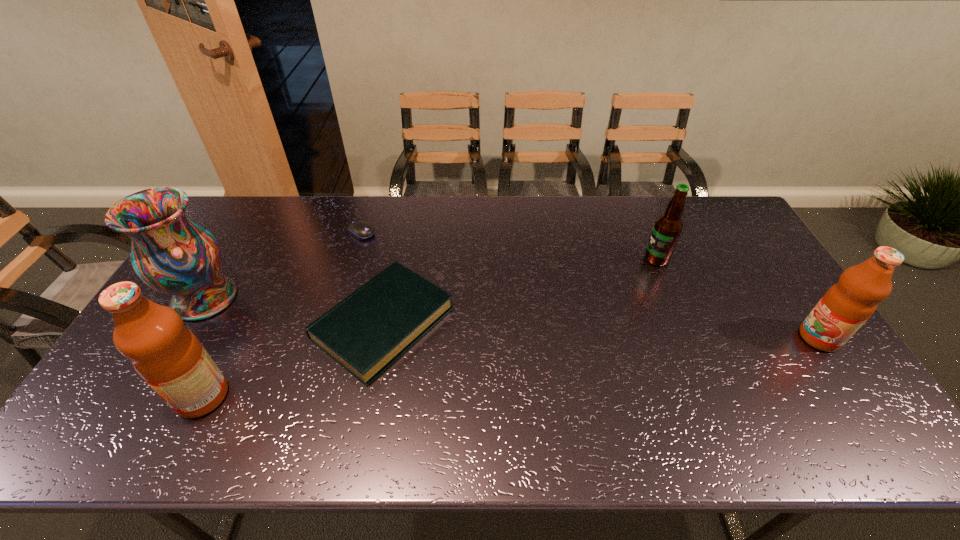
Where is `free space located 0.150m on the front label of the left fruit juice`? free space located 0.150m on the front label of the left fruit juice is located at coordinates (116, 396).

Identify the location of vacant space located on the front label of the left fruit juice. [x=120, y=396].

You are a GUI agent. You are given a task and a screenshot of the screen. Output one action in this format:
    pyautogui.click(x=<x>, y=<y>)
    Task: Click on the vacant space located 0.070m on the front label of the left fruit juice
    This screenshot has width=960, height=540.
    Given the screenshot: What is the action you would take?
    pyautogui.click(x=149, y=396)

Image resolution: width=960 pixels, height=540 pixels. Find the location of `vacant region located on the front label of the shorter fruit juice`. vacant region located on the front label of the shorter fruit juice is located at coordinates (691, 338).

This screenshot has width=960, height=540. I want to click on blank area located on the front label of the shorter fruit juice, so click(684, 338).

What are the coordinates of `blank space located on the front label of the shorter fruit juice` in the screenshot? It's located at (750, 338).

This screenshot has height=540, width=960. Find the location of `vacant space located on the back of the farthest object`. vacant space located on the back of the farthest object is located at coordinates pyautogui.click(x=369, y=208).

Image resolution: width=960 pixels, height=540 pixels. What are the coordinates of `vacant space located 0.270m on the label of the fifth nearest object` in the screenshot? It's located at (562, 259).

The image size is (960, 540). I want to click on vacant area located 0.190m on the label of the fifth nearest object, so click(587, 259).

Find the location of a particular element. free space located on the label of the fifth nearest object is located at coordinates (592, 259).